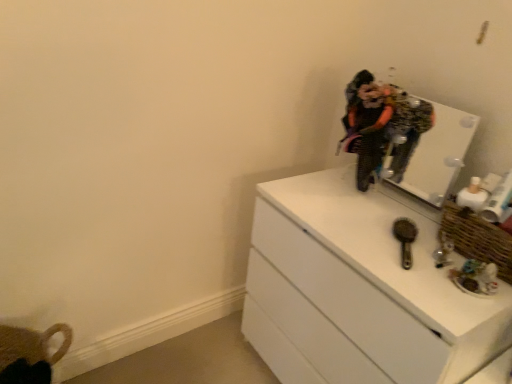
The height and width of the screenshot is (384, 512). I want to click on free space in front of textured black dress at center, so (359, 206).